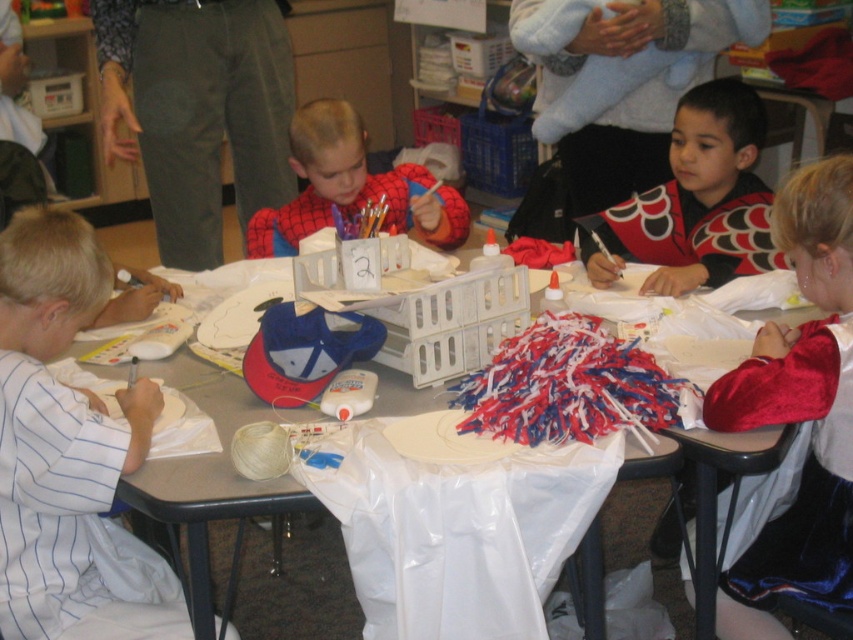
Question: Can you confirm if white striped shirt at left is wider than smooth plastic table at center?

Choices:
 (A) yes
 (B) no

Answer: (B)

Question: Which object is positioned farthest from the spiderman costume at center?

Choices:
 (A) red and black costume at center
 (B) white striped shirt at left
 (C) smooth plastic table at center

Answer: (B)

Question: Which point is closer to the camera taking this photo?

Choices:
 (A) (260, 252)
 (B) (743, 257)
 (C) (688, 451)

Answer: (C)

Question: Is red and black costume at center wider than spiderman costume at center?

Choices:
 (A) yes
 (B) no

Answer: (B)

Question: Which object is the closest to the smooth plastic table at center?

Choices:
 (A) spiderman costume at center
 (B) red and black costume at center
 (C) white striped shirt at left

Answer: (C)

Question: Is smooth plastic table at center below spiderman costume at center?

Choices:
 (A) yes
 (B) no

Answer: (A)